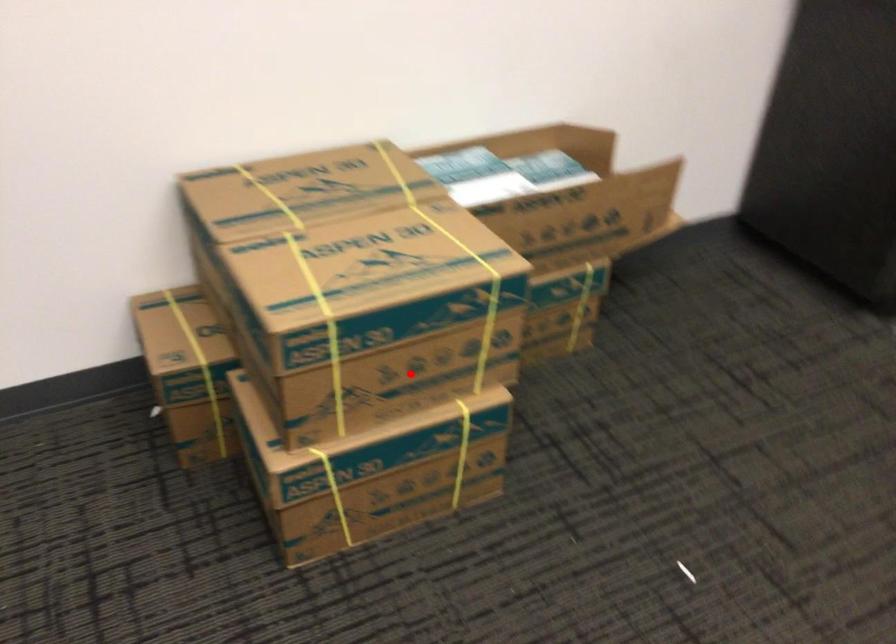
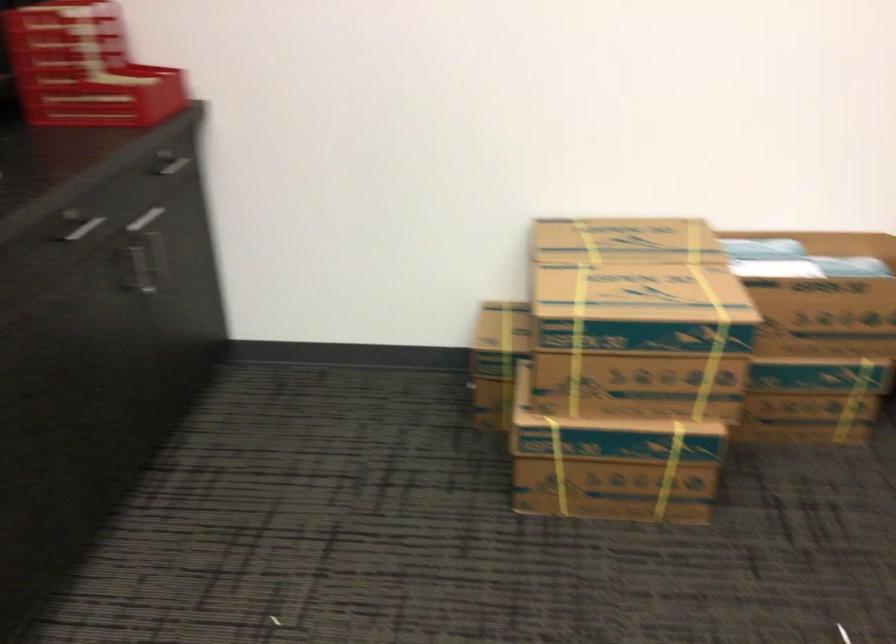
Where in the second image is the point corresponding to the highlighted location from the first image?

(638, 386)